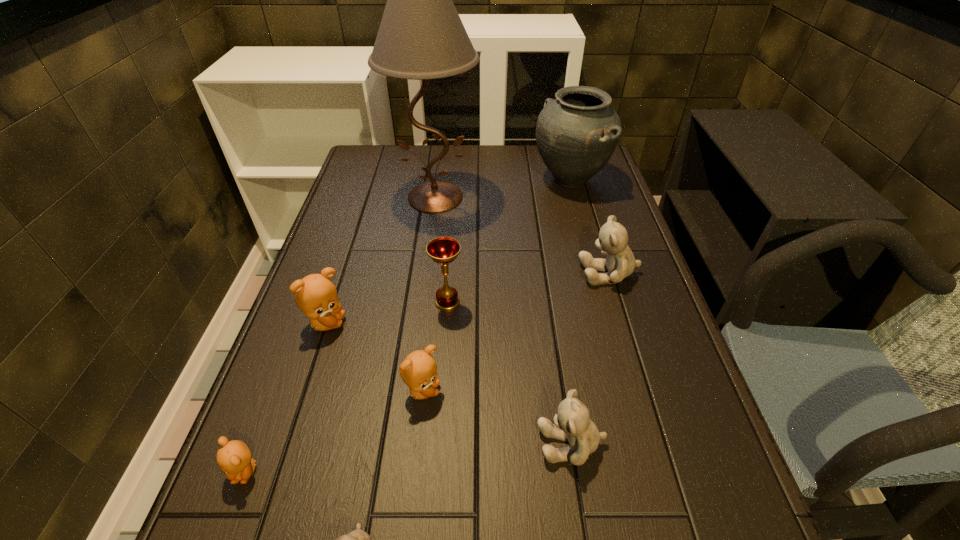
I want to click on the tallest object, so click(421, 36).

Locate an element on the screen. This screenshot has width=960, height=540. urn is located at coordinates (x=576, y=134).

Where is `black urn`? The width and height of the screenshot is (960, 540). black urn is located at coordinates click(x=576, y=134).

The width and height of the screenshot is (960, 540). In order to click on chalice in this screenshot , I will do coord(443,250).

The image size is (960, 540). Find the location of `the biggest brown teddy bear`. the biggest brown teddy bear is located at coordinates (316, 296).

Where is `the second farthest teddy bear`? This screenshot has height=540, width=960. the second farthest teddy bear is located at coordinates (316, 296).

Identify the location of the rightmost teddy bear. Image resolution: width=960 pixels, height=540 pixels. (620, 262).

I want to click on the farthest gray teddy bear, so click(x=620, y=262).

Find the location of `the rightmost brown teddy bear`. the rightmost brown teddy bear is located at coordinates (418, 370).

Image resolution: width=960 pixels, height=540 pixels. I want to click on the fourth nearest object, so click(418, 370).